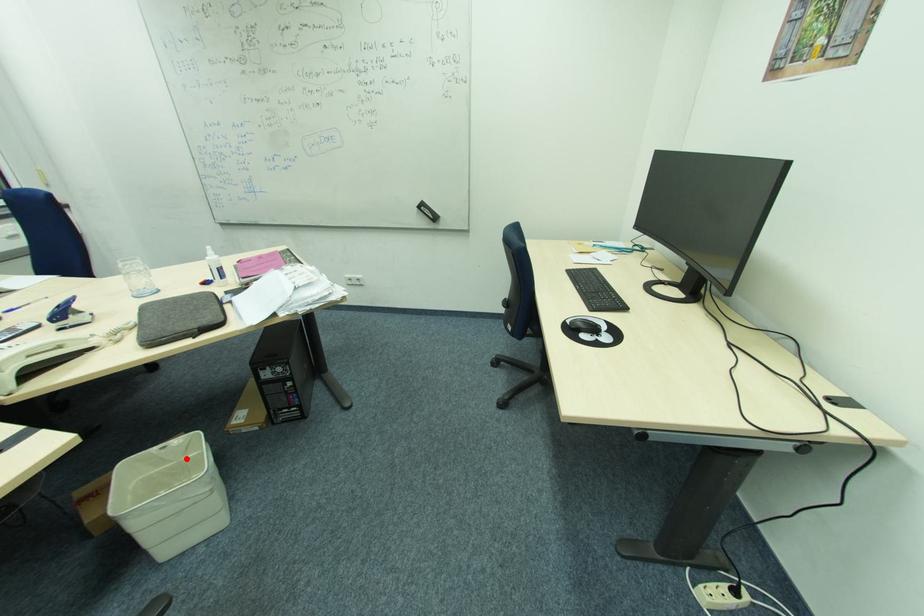
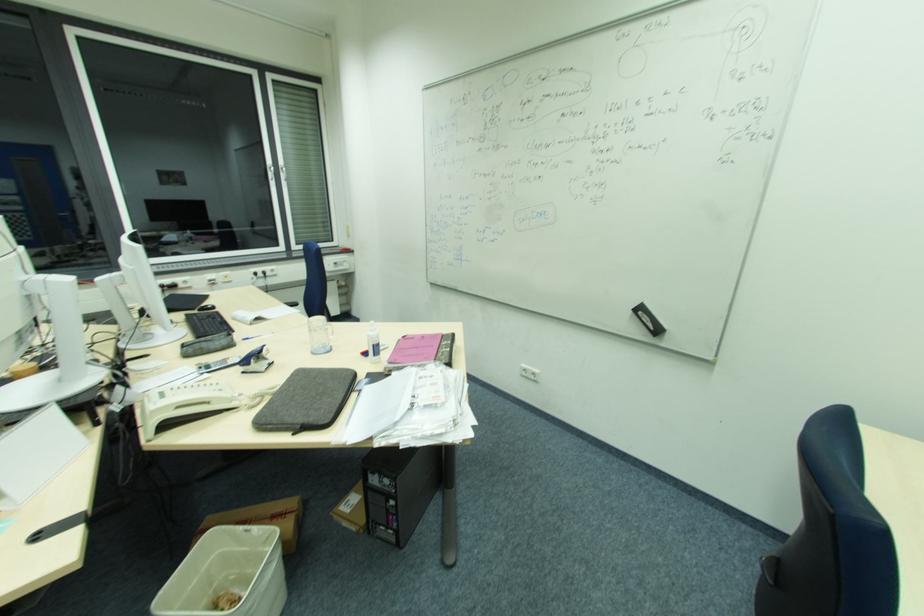
In the second image, find the point that corresponds to the highlighted location in the first image.

(263, 548)